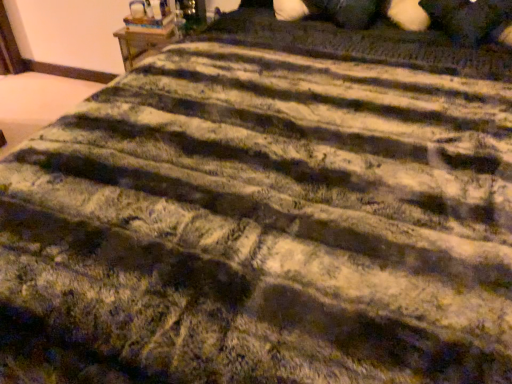
Measure the distance between white fluffy pillow at upper right and camera.

white fluffy pillow at upper right is 4.95 feet from camera.

The height and width of the screenshot is (384, 512). What are the coordinates of `white fluffy pillow at upper right` in the screenshot? It's located at (469, 19).

This screenshot has width=512, height=384. What do you see at coordinates (469, 19) in the screenshot?
I see `white fluffy pillow at upper right` at bounding box center [469, 19].

Where is `white fluffy pillow at upper right`? The width and height of the screenshot is (512, 384). white fluffy pillow at upper right is located at coordinates (469, 19).